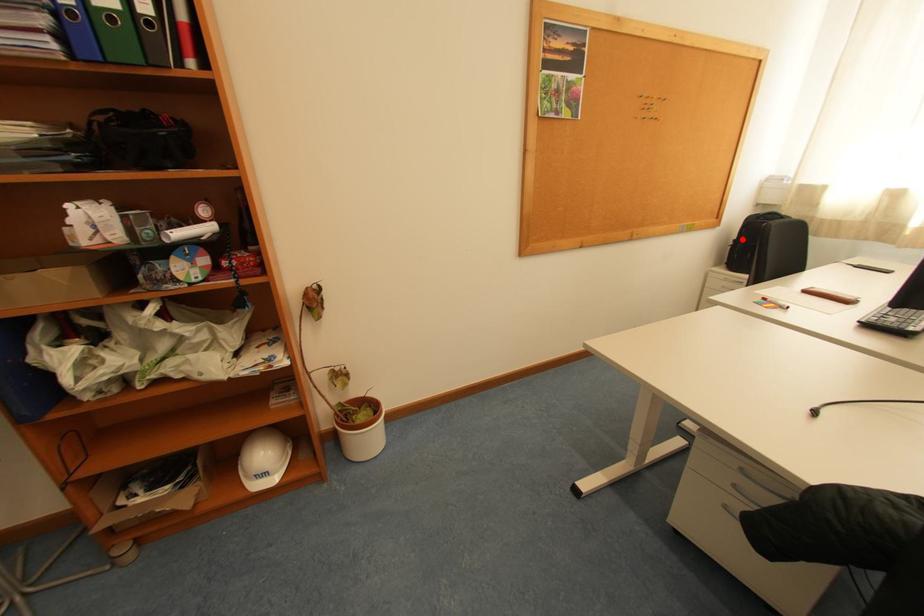
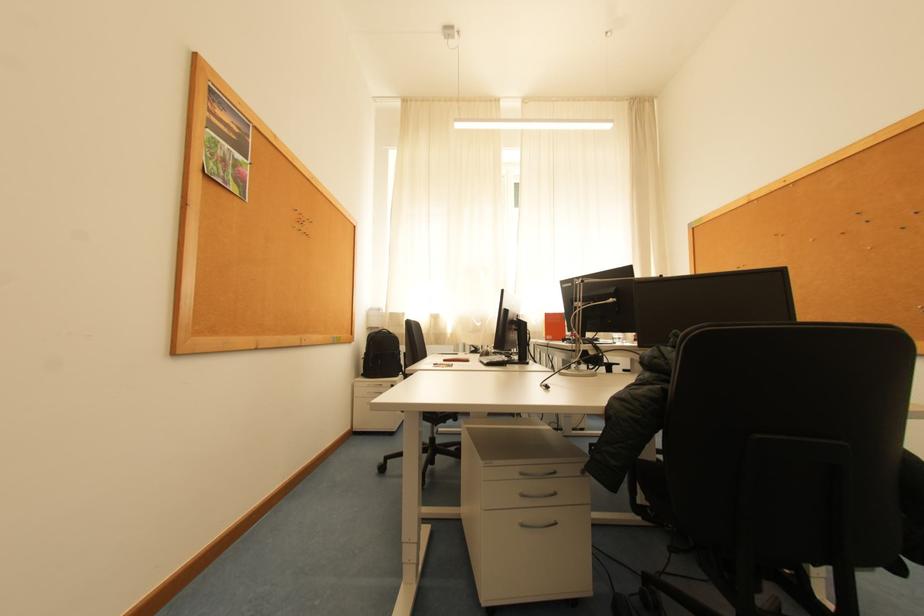
Question: I am providing you with two images of the same scene from different viewpoints. Image1 has a red point marked. In image2, the corresponding 3D location appears at what relative position? Reply with the corresponding letter.

Choices:
 (A) Closer
 (B) Farther

Answer: (B)